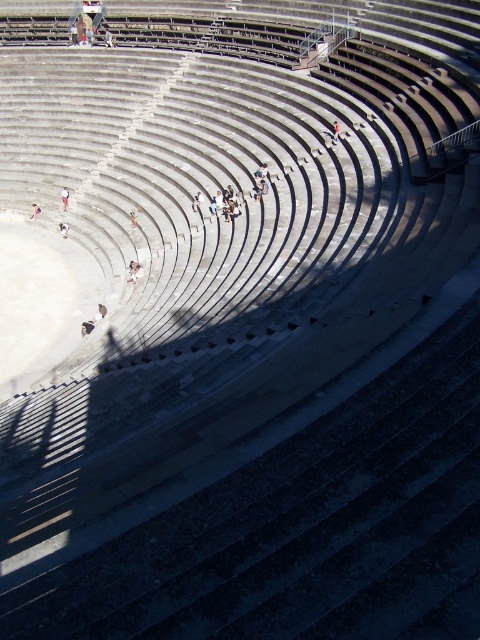
How far apart are light brown fabric person at lower left and white fabric at center?

light brown fabric person at lower left and white fabric at center are 5.12 meters apart.

Does point (63, 202) come closer to viewer compared to point (67, 232)?

No, (63, 202) is behind (67, 232).

Find the location of a particular element. light brown fabric person at lower left is located at coordinates (64, 196).

Measure the distance between light brown leather bag at lower left and light brown wooden chair at upper center.

A: The distance of light brown leather bag at lower left from light brown wooden chair at upper center is 55.75 meters.

Is point (94, 316) positioned before point (74, 28)?

Yes.

Measure the distance between light brown leather bag at lower left and camera.

The distance of light brown leather bag at lower left from camera is 49.79 meters.

The image size is (480, 640). In order to click on light brown leather bag at lower left in this screenshot , I will do tap(99, 314).

Is point (69, 29) farther from camera compared to point (63, 228)?

Yes, point (69, 29) is farther from viewer.

Who is higher up, light brown wooden chair at upper center or white fabric at center?

light brown wooden chair at upper center

Find the location of a particular element. light brown wooden chair at upper center is located at coordinates (72, 35).

The width and height of the screenshot is (480, 640). I want to click on light brown wooden chair at upper center, so coord(72,35).